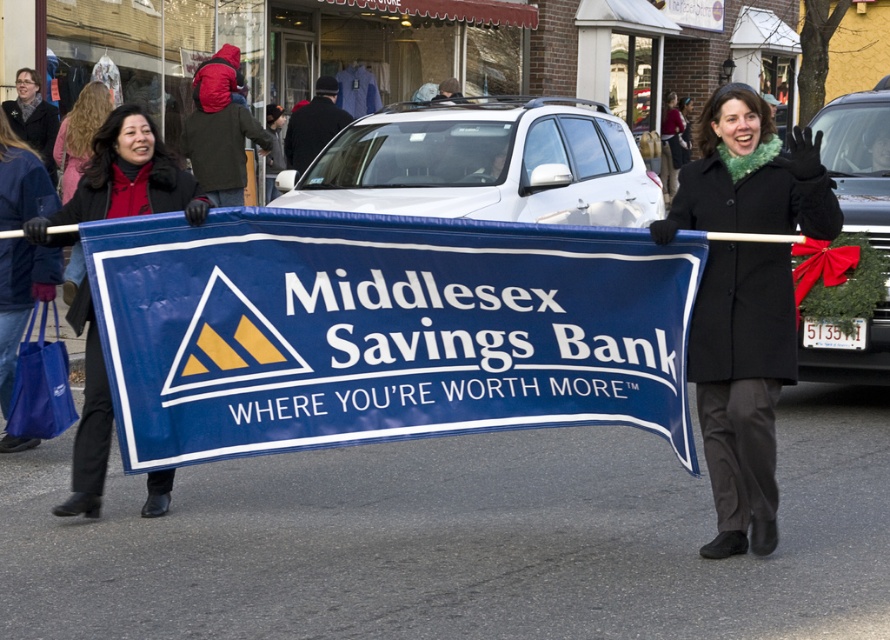
You are a photographer trying to capture both the black wool coat at center and the matte black coat at center in a single shot. Since they are both at the center, which one is positioned lower in the frame?

The black wool coat at center is below the matte black coat at center, so it is positioned lower in the frame.

You are a photographer trying to capture both the blue fabric banner at center and the black wool coat at center in a single frame. Given their sizes, which object should you focus on to ensure both are clearly visible in the photo?

The blue fabric banner at center is larger than the black wool coat at center, so focusing on the banner will help ensure both objects are clearly visible in the photo.

You are a photographer trying to capture a clear photo of both the blue fabric banner at center and the matte black coat at center. Since the banner is much taller than the coat, how might you adjust your camera angle to ensure both are fully visible in the frame?

Since the blue fabric banner at center is much taller than the matte black coat at center, you should tilt your camera upward slightly to include the full height of the banner while still capturing the coat at the base.